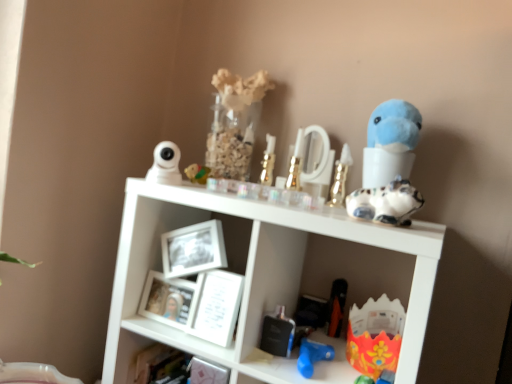
Question: In the image, is matte yellow toy at upper center, the 9th toy in the right-to-left sequence, on the left side or the right side of white glossy picture frame at center, the 1th picture frame in the right-to-left sequence?

Choices:
 (A) left
 (B) right

Answer: (A)

Question: Choose the correct answer: Is matte yellow toy at upper center, which ranks as the 2th toy in left-to-right order, inside white glossy picture frame at center, the 1th picture frame in the right-to-left sequence, or outside it?

Choices:
 (A) inside
 (B) outside

Answer: (B)

Question: Which is farther from the white glossy picture frame at center, the second picture frame viewed from the left?

Choices:
 (A) speckled ceramic cat at upper right, the 9th toy from the left
 (B) gold metallic perfume bottle at upper center, which is the seventh toy in left-to-right order
 (C) white matte picture frame at center, which is the 2th picture frame from right to left
 (D) matte yellow toy at upper center, which ranks as the 2th toy in left-to-right order
 (E) blue plush toy at upper right

Answer: (E)

Question: Which of these objects is positioned closest to the white matte picture frame at center, which is the 2th picture frame from right to left?

Choices:
 (A) blue plastic toy at lower center, the fifth toy in the right-to-left sequence
 (B) matte yellow toy at upper center, the 9th toy in the right-to-left sequence
 (C) metallic silver perfume bottle at lower center, which is counted as the 7th toy, starting from the right
 (D) gold metallic candlestick at center, placed as the eighth toy when sorted from right to left
 (E) white glossy picture frame at center, the second picture frame viewed from the left

Answer: (E)